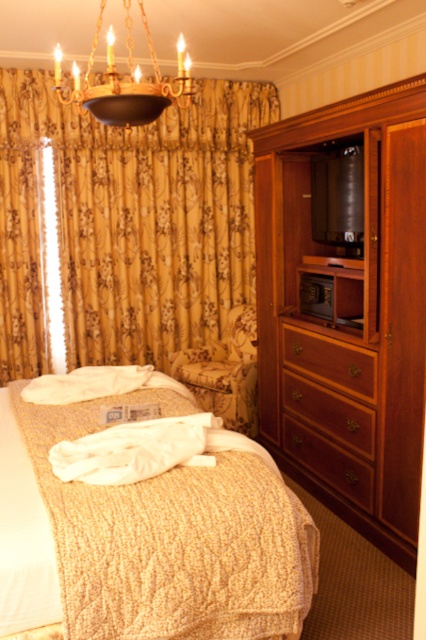
Which is in front, point (123, 582) or point (325, 433)?

Positioned in front is point (123, 582).

Can you confirm if beige quilted bed at center is shorter than wooden drawer at right?

No, beige quilted bed at center is not shorter than wooden drawer at right.

The image size is (426, 640). I want to click on beige quilted bed at center, so click(x=173, y=536).

Who is positioned more to the right, gold floral fabric curtain at upper left or wooden drawer at center?

A: Positioned to the right is wooden drawer at center.

Which of these two, gold floral fabric curtain at upper left or wooden drawer at center, stands taller?

gold floral fabric curtain at upper left is taller.

Locate an element on the screen. The width and height of the screenshot is (426, 640). gold floral fabric curtain at upper left is located at coordinates (129, 221).

Between beige quilted bed at center and wooden drawer at center, which one appears on the right side from the viewer's perspective?

wooden drawer at center

Which of these two, beige quilted bed at center or wooden drawer at center, stands shorter?

wooden drawer at center is shorter.

Does point (97, 433) come behind point (351, 371)?

No.

Locate an element on the screen. This screenshot has width=426, height=640. beige quilted bed at center is located at coordinates (173, 536).